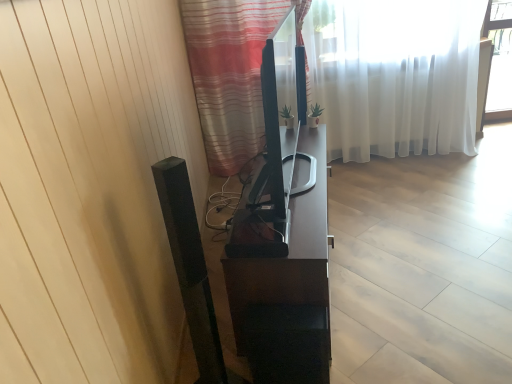
Question: Which direction should I rotate to look at white sheer curtain at upper center, marked as the 1th curtain in a back-to-front arrangement, — up or down?

Choices:
 (A) up
 (B) down

Answer: (A)

Question: Would you consider striped fabric curtain at center, which ranks as the 2th curtain in back-to-front order, to be distant from white sheer curtain at upper center, which ranks as the 2th curtain in front-to-back order?

Choices:
 (A) yes
 (B) no

Answer: (B)

Question: Does striped fabric curtain at center, which is counted as the first curtain, starting from the front, have a lesser height compared to white sheer curtain at upper center, which ranks as the 2th curtain in front-to-back order?

Choices:
 (A) no
 (B) yes

Answer: (B)

Question: Does striped fabric curtain at center, which ranks as the 2th curtain in back-to-front order, have a greater height compared to white sheer curtain at upper center, marked as the 1th curtain in a back-to-front arrangement?

Choices:
 (A) no
 (B) yes

Answer: (A)

Question: Is striped fabric curtain at center, which ranks as the 2th curtain in back-to-front order, to the right of white sheer curtain at upper center, marked as the 1th curtain in a back-to-front arrangement, from the viewer's perspective?

Choices:
 (A) yes
 (B) no

Answer: (B)

Question: Is striped fabric curtain at center, which is counted as the first curtain, starting from the front, next to white sheer curtain at upper center, which ranks as the 2th curtain in front-to-back order?

Choices:
 (A) no
 (B) yes

Answer: (A)

Question: Is striped fabric curtain at center, which is counted as the first curtain, starting from the front, at the left side of white sheer curtain at upper center, marked as the 1th curtain in a back-to-front arrangement?

Choices:
 (A) yes
 (B) no

Answer: (A)

Question: From a real-world perspective, is white sheer curtain at upper center, which ranks as the 2th curtain in front-to-back order, over satin black tv stand at center?

Choices:
 (A) no
 (B) yes

Answer: (B)

Question: Can you confirm if white sheer curtain at upper center, marked as the 1th curtain in a back-to-front arrangement, is smaller than satin black tv stand at center?

Choices:
 (A) yes
 (B) no

Answer: (B)

Question: Considering the relative sizes of white sheer curtain at upper center, which ranks as the 2th curtain in front-to-back order, and satin black tv stand at center in the image provided, is white sheer curtain at upper center, which ranks as the 2th curtain in front-to-back order, thinner than satin black tv stand at center?

Choices:
 (A) no
 (B) yes

Answer: (B)

Question: From a real-world perspective, is white sheer curtain at upper center, which ranks as the 2th curtain in front-to-back order, physically below satin black tv stand at center?

Choices:
 (A) no
 (B) yes

Answer: (A)

Question: Is white sheer curtain at upper center, which ranks as the 2th curtain in front-to-back order, bigger than satin black tv stand at center?

Choices:
 (A) no
 (B) yes

Answer: (B)

Question: Is white sheer curtain at upper center, marked as the 1th curtain in a back-to-front arrangement, surrounding satin black tv stand at center?

Choices:
 (A) no
 (B) yes

Answer: (A)

Question: Is white sheer curtain at upper center, marked as the 1th curtain in a back-to-front arrangement, taller than striped fabric curtain at center, which is counted as the first curtain, starting from the front?

Choices:
 (A) yes
 (B) no

Answer: (A)